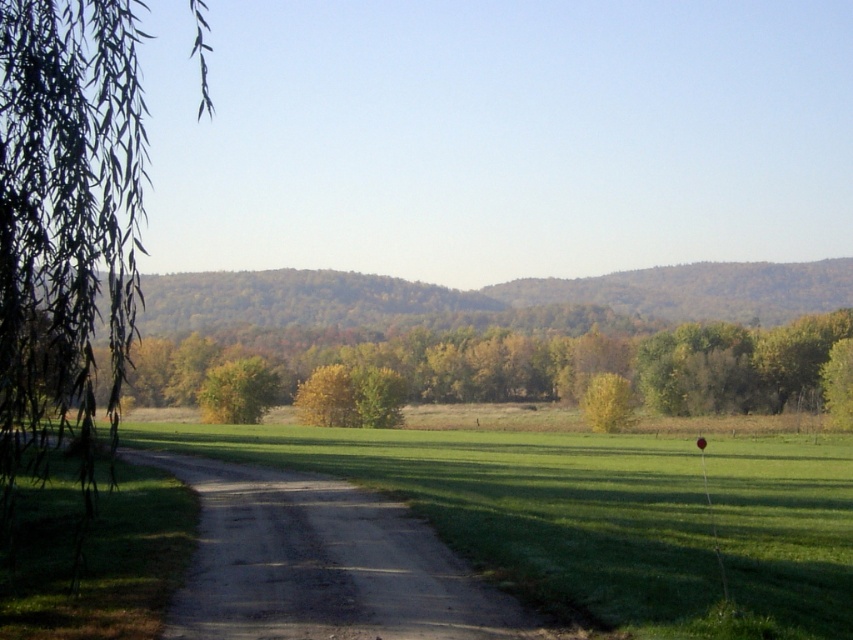
Question: Which of these objects is positioned farthest from the yellow-green leafy tree at center-right?

Choices:
 (A) green leafy tree at center
 (B) green leafy tree at right
 (C) green grass at center

Answer: (C)

Question: Among these objects, which one is farthest from the camera?

Choices:
 (A) yellow-green leafy tree at center
 (B) green grass at center
 (C) green leafy tree at center

Answer: (A)

Question: Which point appears farthest from the camera in this image?

Choices:
 (A) (695, 353)
 (B) (373, 506)
 (C) (630, 582)

Answer: (A)

Question: Where is green leafy tree at center located in relation to dirt/gravel path at center in the image?

Choices:
 (A) above
 (B) below

Answer: (A)

Question: Can you confirm if yellow-green leafy tree at center-right is positioned below green leafy tree at right?

Choices:
 (A) no
 (B) yes

Answer: (B)

Question: Is yellow-green leafy tree at center bigger than yellow-green leafy tree at center-right?

Choices:
 (A) no
 (B) yes

Answer: (B)